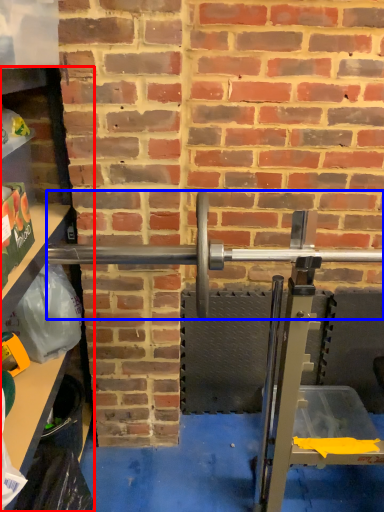
Question: Which object is closer to the camera taking this photo, shelf (highlighted by a red box) or barbell (highlighted by a blue box)?

Choices:
 (A) shelf
 (B) barbell

Answer: (A)